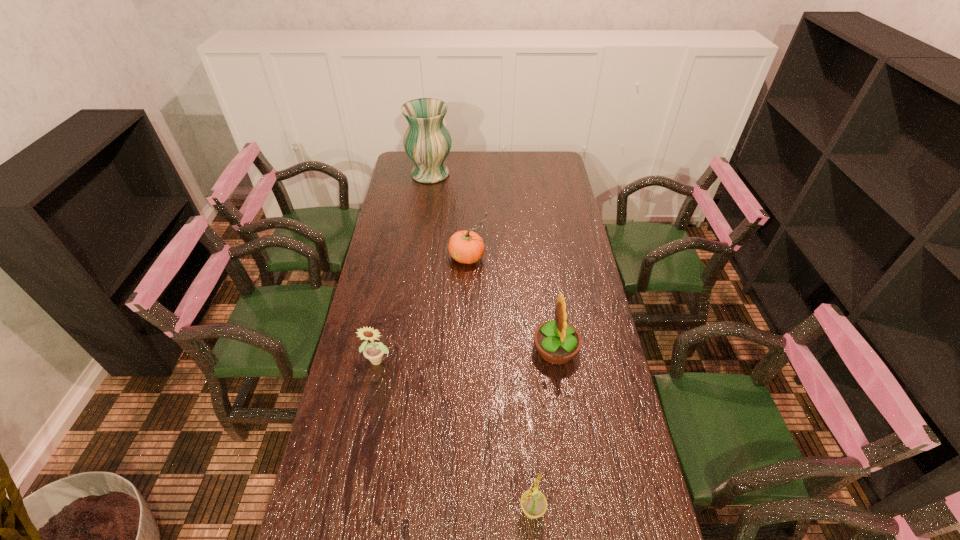
Locate an element on the screen. vacant area between the leftmost sunflower and the vase is located at coordinates (405, 267).

At what (x,y) coordinates should I click in order to perform the action: click on free space between the tallest sunflower and the nearest sunflower. Please return your answer as a coordinate pair (x, y). Looking at the image, I should click on (543, 430).

Where is `empty location between the leftmost sunflower and the pumpkin`? The height and width of the screenshot is (540, 960). empty location between the leftmost sunflower and the pumpkin is located at coordinates (423, 308).

Locate an element on the screen. The image size is (960, 540). vacant point located between the fourth nearest object and the vase is located at coordinates point(449,215).

This screenshot has height=540, width=960. I want to click on free point between the pumpkin and the leftmost sunflower, so click(423, 308).

Where is `object identified as the closest to the rightmost object`? The height and width of the screenshot is (540, 960). object identified as the closest to the rightmost object is located at coordinates (467, 247).

The image size is (960, 540). In order to click on object that ranks as the closest to the vase in this screenshot , I will do `click(467, 247)`.

I want to click on sunflower that stands as the closest to the nearest sunflower, so click(557, 342).

This screenshot has width=960, height=540. I want to click on sunflower that is the closest one to the nearest object, so click(557, 342).

You are a GUI agent. You are given a task and a screenshot of the screen. Output one action in this format:
    pyautogui.click(x=<x>, y=<y>)
    Task: Click on the free region that satisfies the following two spatial constraints: 1. on the face of the tallest sunflower; 2. on the front-facing side of the leftmost sunflower
    The image size is (960, 540).
    Given the screenshot: What is the action you would take?
    pyautogui.click(x=557, y=360)